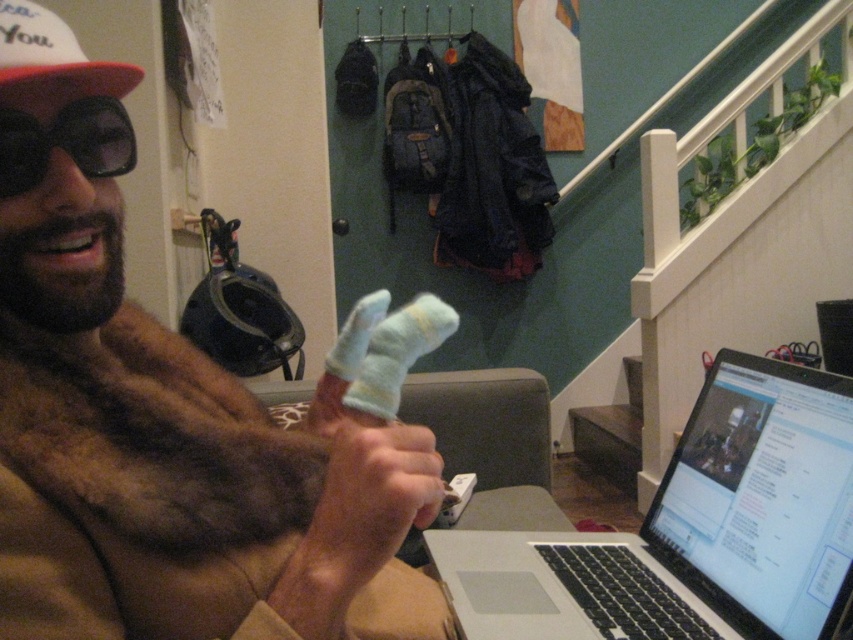
Can you confirm if white fuzzy socks at center is wider than white fabric baseball cap at upper left?

Correct, the width of white fuzzy socks at center exceeds that of white fabric baseball cap at upper left.

Which is behind, point (398, 432) or point (6, 10)?

Point (6, 10)

Where is `white fuzzy socks at center`? The image size is (853, 640). white fuzzy socks at center is located at coordinates (368, 500).

Between fuzzy fur at center and white fuzzy socks at center, which one has less height?

white fuzzy socks at center is shorter.

Does fuzzy fur at center appear on the right side of white fuzzy socks at center?

In fact, fuzzy fur at center is to the left of white fuzzy socks at center.

What do you see at coordinates (164, 420) in the screenshot? This screenshot has height=640, width=853. I see `fuzzy fur at center` at bounding box center [164, 420].

Image resolution: width=853 pixels, height=640 pixels. I want to click on fuzzy fur at center, so click(x=164, y=420).

Which is behind, point (224, 458) or point (51, 64)?

The point (224, 458) is behind.

Is fuzzy fur at center wider than white fabric baseball cap at upper left?

Correct, the width of fuzzy fur at center exceeds that of white fabric baseball cap at upper left.

Describe the element at coordinates (164, 420) in the screenshot. This screenshot has height=640, width=853. I see `fuzzy fur at center` at that location.

At what (x,y) coordinates should I click in order to perform the action: click on fuzzy fur at center. Please return your answer as a coordinate pair (x, y). Looking at the image, I should click on (164, 420).